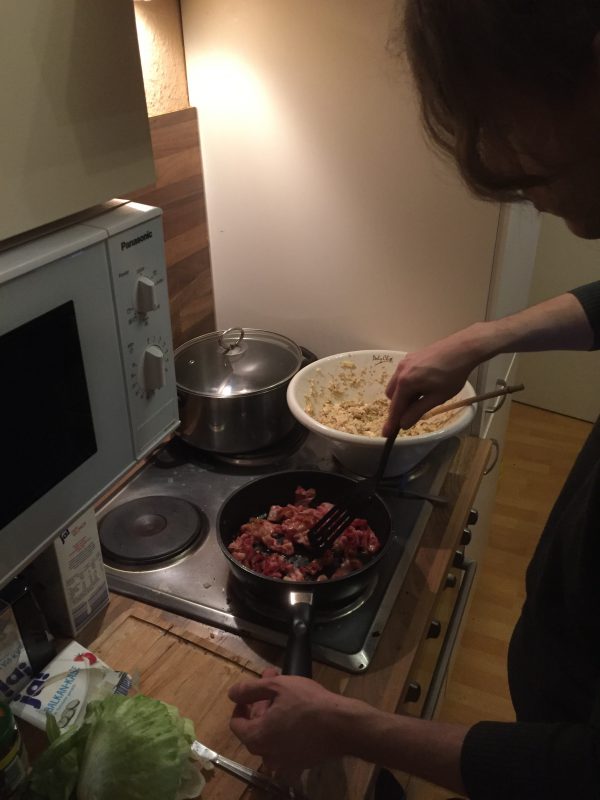
In order to click on tan floor in this screenshot , I will do `click(527, 494)`.